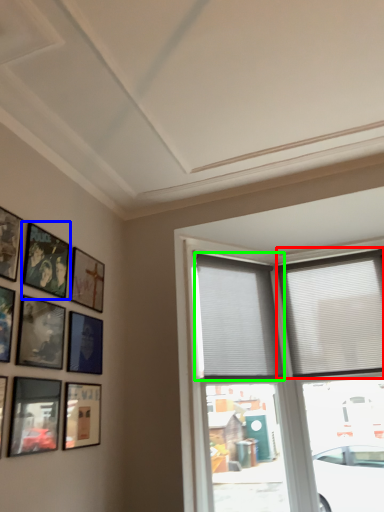
Question: Which object is positioned closest to window (highlighted by a red box)? Select from picture frame (highlighted by a blue box) and window (highlighted by a green box).

Choices:
 (A) picture frame
 (B) window

Answer: (B)